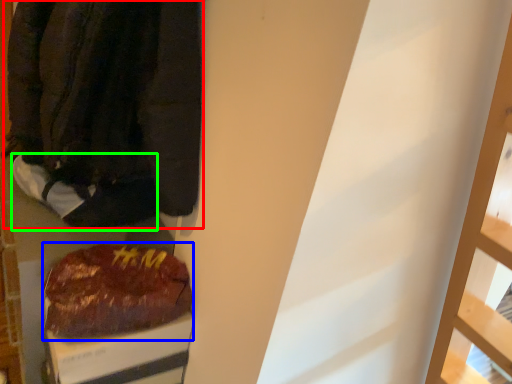
Question: Considering the real-world distances, which object is closest to jacket (highlighted by a red box)? food (highlighted by a blue box) or footwear (highlighted by a green box).

Choices:
 (A) food
 (B) footwear

Answer: (B)